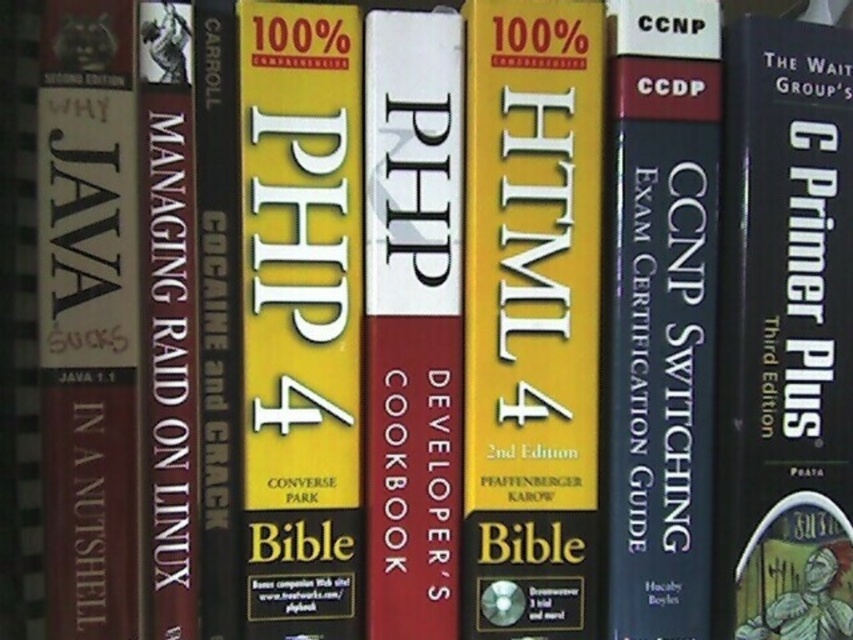
Question: Is yellow matte/html book at center positioned before black matte book at right?

Choices:
 (A) yes
 (B) no

Answer: (A)

Question: Among these points, which one is farthest from the camera?

Choices:
 (A) (267, 628)
 (B) (389, 86)
 (C) (651, 316)
 (D) (811, 259)

Answer: (D)

Question: Among these objects, which one is farthest from the camera?

Choices:
 (A) black hardcover book at center
 (B) white matte php developer's cookbook at center
 (C) black matte book at right

Answer: (C)

Question: Which object is the farthest from the black matte book at right?

Choices:
 (A) yellow matte book at center
 (B) white matte php developer's cookbook at center

Answer: (A)

Question: Does black matte book at right appear on the left side of black hardcover book at center?

Choices:
 (A) yes
 (B) no

Answer: (B)

Question: Is black matte book at right thinner than white matte php developer's cookbook at center?

Choices:
 (A) yes
 (B) no

Answer: (B)